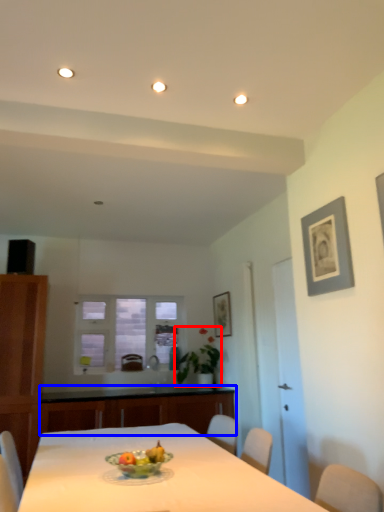
Question: Which of the following is the closest to the observer, plant (highlighted by a red box) or counter top (highlighted by a blue box)?

Choices:
 (A) plant
 (B) counter top

Answer: (B)